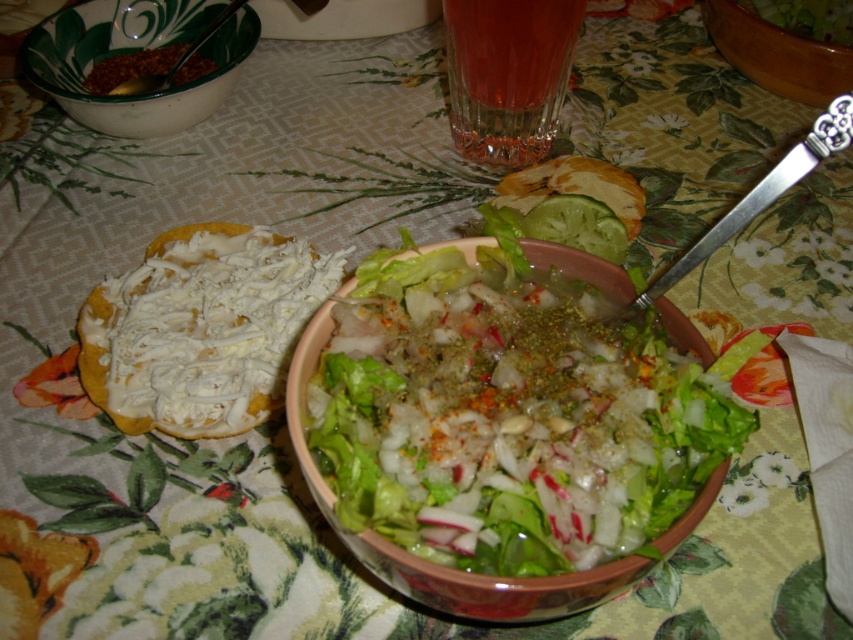
You have a small spoon that is 6 cm wide. You want to use it to serve food from both the green ceramic bowl at upper left and the translucent glass at upper center. Which container will allow the spoon to fit more easily?

The green ceramic bowl at upper left might be wider than the translucent glass at upper center, so the spoon will fit more easily in the green ceramic bowl at upper left.

You are a food critic who wants to take a photo of the fresh green salad at center and the translucent glass at upper center. Which object should you focus on first if you want to capture both in a single shot without moving the camera?

The fresh green salad at center is much taller than the translucent glass at upper center, so you should focus on the fresh green salad at center first to ensure both objects are in frame.